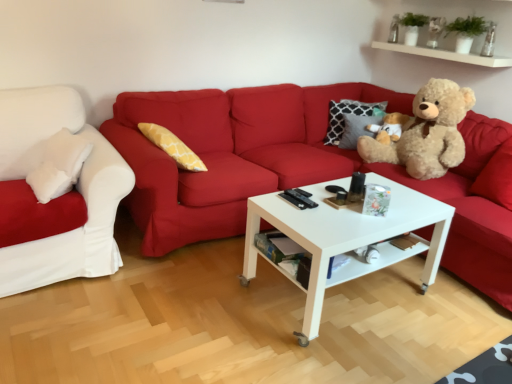
Question: Is white glossy coffee table at center oriented away from light brown plush teddy bear at right?

Choices:
 (A) no
 (B) yes

Answer: (A)

Question: Is white glossy coffee table at center bigger than light brown plush teddy bear at right?

Choices:
 (A) yes
 (B) no

Answer: (A)

Question: Could you tell me if white glossy coffee table at center is turned towards light brown plush teddy bear at right?

Choices:
 (A) yes
 (B) no

Answer: (B)

Question: From a real-world perspective, is white glossy coffee table at center physically below light brown plush teddy bear at right?

Choices:
 (A) no
 (B) yes

Answer: (B)

Question: Can you confirm if white glossy coffee table at center is positioned to the left of light brown plush teddy bear at right?

Choices:
 (A) yes
 (B) no

Answer: (A)

Question: Is white glossy coffee table at center spatially inside white soft cushion at left, which is counted as the second studio couch, starting from the right, or outside of it?

Choices:
 (A) outside
 (B) inside

Answer: (A)

Question: Does point (329, 206) appear closer or farther from the camera than point (109, 182)?

Choices:
 (A) closer
 (B) farther

Answer: (A)

Question: From the image's perspective, is white glossy coffee table at center positioned above or below white soft cushion at left, marked as the 1th studio couch in a left-to-right arrangement?

Choices:
 (A) below
 (B) above

Answer: (A)

Question: Relative to white soft cushion at left, which is counted as the second studio couch, starting from the right, is white glossy coffee table at center in front or behind?

Choices:
 (A) front
 (B) behind

Answer: (A)

Question: In the image, is white glossy shelf at upper right on the left side or the right side of light brown plush teddy bear at right?

Choices:
 (A) left
 (B) right

Answer: (B)

Question: In the image, is white glossy shelf at upper right positioned in front of or behind light brown plush teddy bear at right?

Choices:
 (A) front
 (B) behind

Answer: (B)

Question: Considering the positions of point (393, 31) and point (394, 160), is point (393, 31) closer or farther from the camera than point (394, 160)?

Choices:
 (A) farther
 (B) closer

Answer: (A)

Question: Considering the positions of white glossy shelf at upper right and light brown plush teddy bear at right in the image, is white glossy shelf at upper right taller or shorter than light brown plush teddy bear at right?

Choices:
 (A) short
 (B) tall

Answer: (A)

Question: Based on their positions, is matte red couch at center, which is counted as the first studio couch, starting from the right, located to the left or right of light brown plush teddy bear at right?

Choices:
 (A) right
 (B) left

Answer: (B)

Question: From their relative heights in the image, would you say matte red couch at center, which is counted as the first studio couch, starting from the right, is taller or shorter than light brown plush teddy bear at right?

Choices:
 (A) tall
 (B) short

Answer: (A)